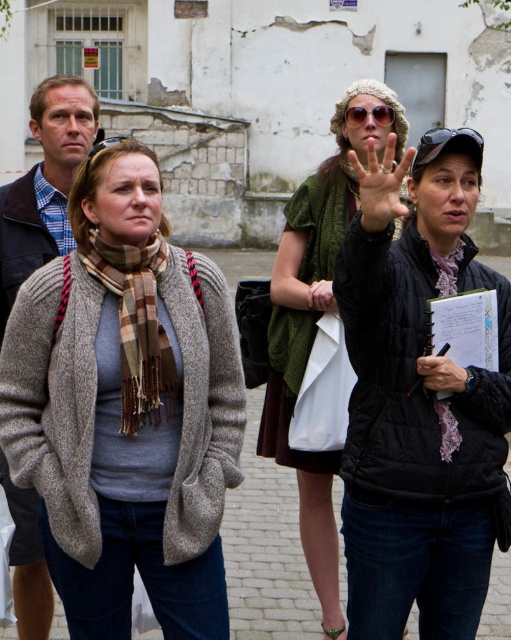
Consider the image. You are a photographer trying to capture a photo of the group. The black quilted jacket at upper right and the blue plaid shirt at upper left are both in the frame. Which clothing item is positioned higher in the image?

The black quilted jacket at upper right is located above the blue plaid shirt at upper left, so it is positioned higher in the image.

Please provide the exact 2D coordinates of the black quilted jacket at upper right in the image. The coordinates should be in the format of a tuple with two decimal numbers between 0 and 1, where the first number represents the horizontal position and the second the vertical position.

The exact 2D coordinates of the black quilted jacket at upper right are at point [417,408].